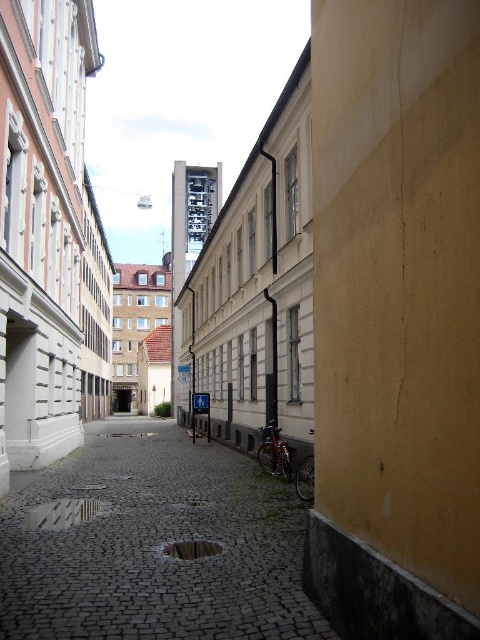
Which of these two, cobblestone alley at center or reflective cobblestone puddle at center, stands taller?

cobblestone alley at center is taller.

Which is behind, point (179, 621) or point (84, 508)?

Point (84, 508)

Locate an element on the screen. cobblestone alley at center is located at coordinates (155, 545).

Locate an element on the screen. The image size is (480, 640). cobblestone alley at center is located at coordinates (155, 545).

Which is below, reflective cobblestone puddle at center or glossy concrete puddle at center?

reflective cobblestone puddle at center is below.

Between reflective cobblestone puddle at center and glossy concrete puddle at center, which one appears on the left side from the viewer's perspective?

From the viewer's perspective, reflective cobblestone puddle at center appears more on the left side.

Find the location of a particular element. This screenshot has width=480, height=640. reflective cobblestone puddle at center is located at coordinates pos(63,513).

Find the location of a particular element. The width and height of the screenshot is (480, 640). reflective cobblestone puddle at center is located at coordinates (63, 513).

Based on the photo, who is more distant from viewer, (146, 532) or (213, 547)?

The point (146, 532) is behind.

Which is above, cobblestone alley at center or glossy concrete puddle at center?

glossy concrete puddle at center

Image resolution: width=480 pixels, height=640 pixels. What do you see at coordinates (155, 545) in the screenshot?
I see `cobblestone alley at center` at bounding box center [155, 545].

Identify the location of cobblestone alley at center. (155, 545).